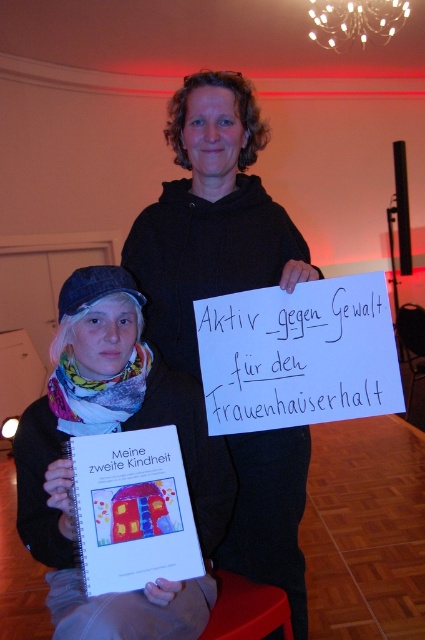
You are a photographer who needs to capture a closeup of both the black hoodie at center and the white fabric scarf at lower left in the scene. What is the minimum distance you need to move closer to ensure both objects are in frame?

The minimum distance to move closer would be 12.88 inches, as that is the distance between the black hoodie at center and the white fabric scarf at lower left.

Based on the photo, you are a photographer at the event and need to capture a closeup of the black hoodie at center and the white fabric scarf at lower left. Which object should you zoom in more on to ensure both are equally visible in the photo?

The black hoodie at center is larger in size than the white fabric scarf at lower left, so you should zoom in more on the white fabric scarf at lower left to balance their sizes in the photo.

You are a photographer standing at point (147,305). You want to take a photo of the two people in the scene. Can you fit both of them in the frame if your camera has a 1.5 meter wide field of view?

The two people are 1.61 meters apart, so the camera with a 1.5 meter wide field of view cannot capture both of them in the same frame.